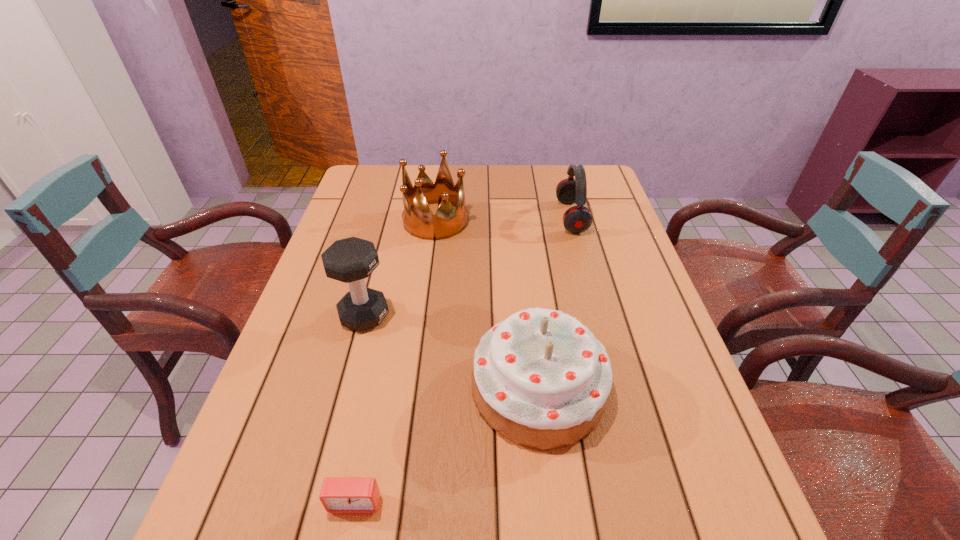
Locate an element on the screen. This screenshot has height=540, width=960. vacant area located 0.190m on the ear cups of the earphone is located at coordinates (496, 217).

Where is `free space located 0.070m on the ear cups of the earphone`? Image resolution: width=960 pixels, height=540 pixels. free space located 0.070m on the ear cups of the earphone is located at coordinates (535, 217).

Find the location of a particular element. This screenshot has width=960, height=540. object that is at the far edge is located at coordinates (577, 219).

Image resolution: width=960 pixels, height=540 pixels. I want to click on object positioned at the left edge, so click(x=350, y=260).

Locate an element on the screen. The height and width of the screenshot is (540, 960). object positioned at the right edge is located at coordinates (577, 219).

Locate an element on the screen. This screenshot has height=540, width=960. object located at the far right corner is located at coordinates (577, 219).

Where is `vacant region at the far edge`? The height and width of the screenshot is (540, 960). vacant region at the far edge is located at coordinates (475, 177).

This screenshot has height=540, width=960. In the image, there is a desktop. In order to click on free space at the left edge in this screenshot , I will do `click(315, 295)`.

I want to click on free spot at the right edge of the desktop, so 592,306.

You are a GUI agent. You are given a task and a screenshot of the screen. Output one action in this format:
    pyautogui.click(x=<x>, y=<y>)
    Task: Click on the vacant space at the far left corner of the desktop
    
    Given the screenshot: What is the action you would take?
    (x=386, y=165)